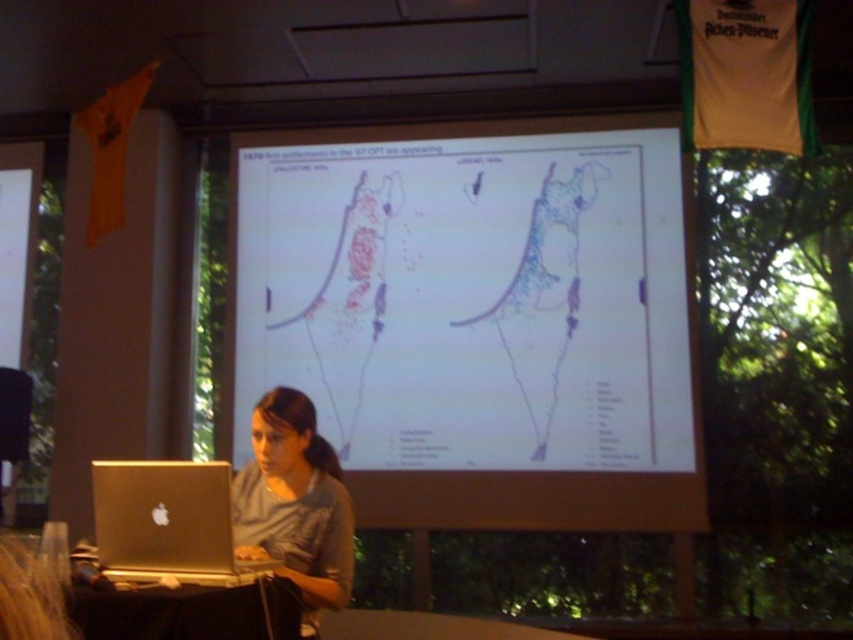
Is white matte map at center smaller than gray fabric shirt at center?

No, white matte map at center is not smaller than gray fabric shirt at center.

Does white matte map at center have a lesser width compared to gray fabric shirt at center?

No.

Image resolution: width=853 pixels, height=640 pixels. Find the location of `white matte map at center`. white matte map at center is located at coordinates (476, 317).

Where is `white matte map at center`? This screenshot has width=853, height=640. white matte map at center is located at coordinates (476, 317).

Does gray fabric shirt at center have a greater width compared to silver metallic laptop at lower left?

No, gray fabric shirt at center is not wider than silver metallic laptop at lower left.

Does gray fabric shirt at center have a larger size compared to silver metallic laptop at lower left?

Correct, gray fabric shirt at center is larger in size than silver metallic laptop at lower left.

Is point (323, 580) farther from viewer compared to point (198, 568)?

Yes.

At what (x,y) coordinates should I click in order to perform the action: click on gray fabric shirt at center. Please return your answer as a coordinate pair (x, y). The width and height of the screenshot is (853, 640). Looking at the image, I should click on (294, 502).

Does white matte map at center appear under silver metallic laptop at lower left?

Incorrect, white matte map at center is not positioned below silver metallic laptop at lower left.

Does white matte map at center appear over silver metallic laptop at lower left?

Correct, white matte map at center is located above silver metallic laptop at lower left.

Locate an element on the screen. white matte map at center is located at coordinates (476, 317).